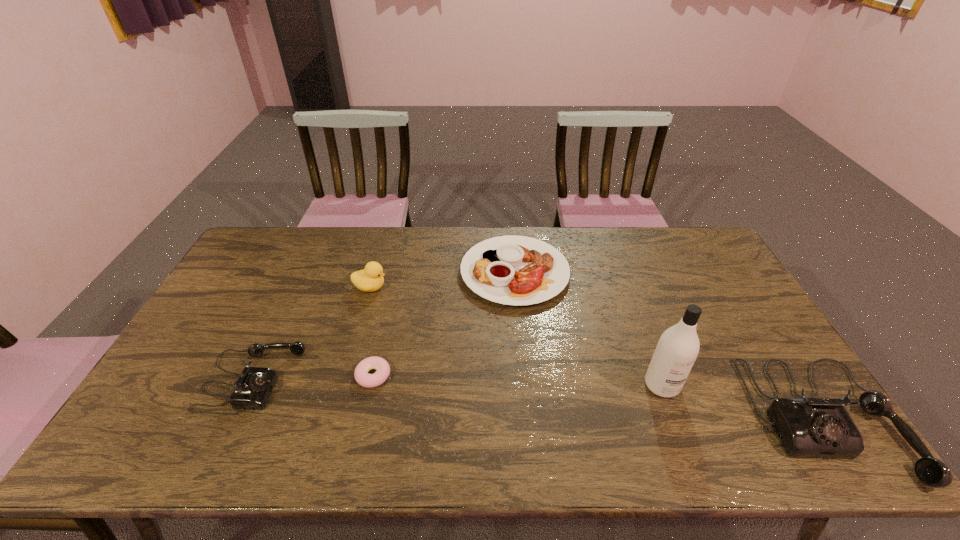
Identify the location of vacant region between the left telephone and the shortest object. (313, 377).

Locate an element on the screen. free point between the second shortest object and the tallest object is located at coordinates (588, 328).

The width and height of the screenshot is (960, 540). In order to click on free space between the fifth object from left to right and the second shortest object in this screenshot , I will do `click(588, 328)`.

Identify the location of free space between the second shortest object and the tallest object. (588, 328).

Where is `object that is the third closest one to the duck`? This screenshot has width=960, height=540. object that is the third closest one to the duck is located at coordinates (362, 377).

At what (x,y) coordinates should I click in order to perform the action: click on object that can be found as the fourth closest to the platter. Please return your answer as a coordinate pair (x, y). Looking at the image, I should click on (808, 427).

The width and height of the screenshot is (960, 540). What are the coordinates of `vacant region that satisfies the following two spatial constraints: 1. on the front-facing side of the duck; 2. on the right side of the shortest object` in the screenshot? It's located at (346, 375).